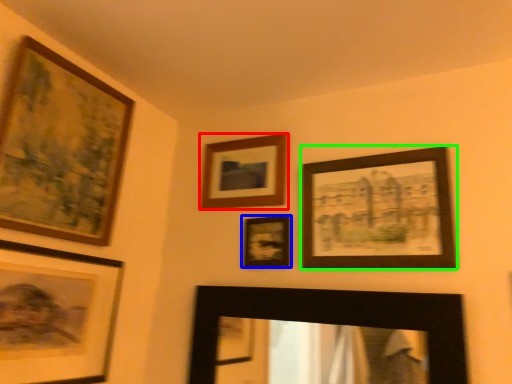
Question: Based on their relative distances, which object is farther from picture frame (highlighted by a red box)? Choose from picture frame (highlighted by a blue box) and picture frame (highlighted by a green box).

Choices:
 (A) picture frame
 (B) picture frame

Answer: (B)